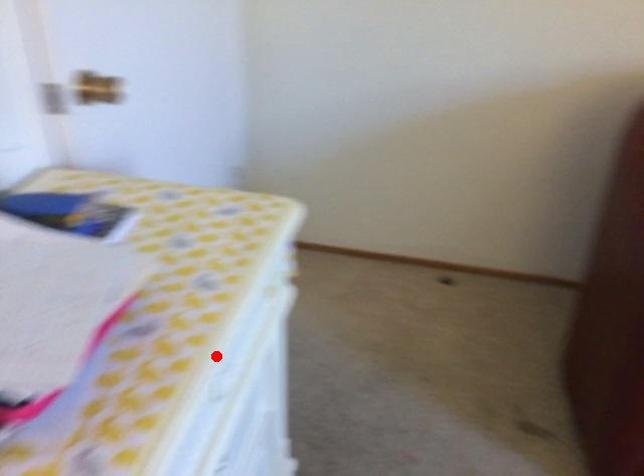
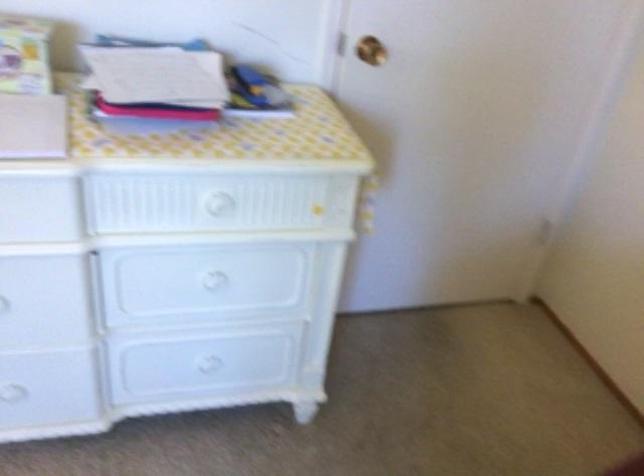
Where in the second image is the point corresponding to the highlighted location from the first image?

(216, 203)